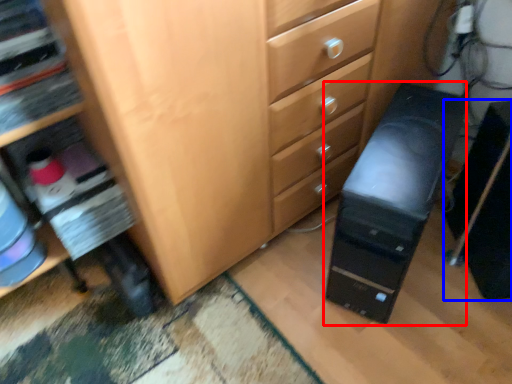
Question: Among these objects, which one is farthest to the camera, computer tower (highlighted by a red box) or computer tower (highlighted by a blue box)?

Choices:
 (A) computer tower
 (B) computer tower

Answer: (B)